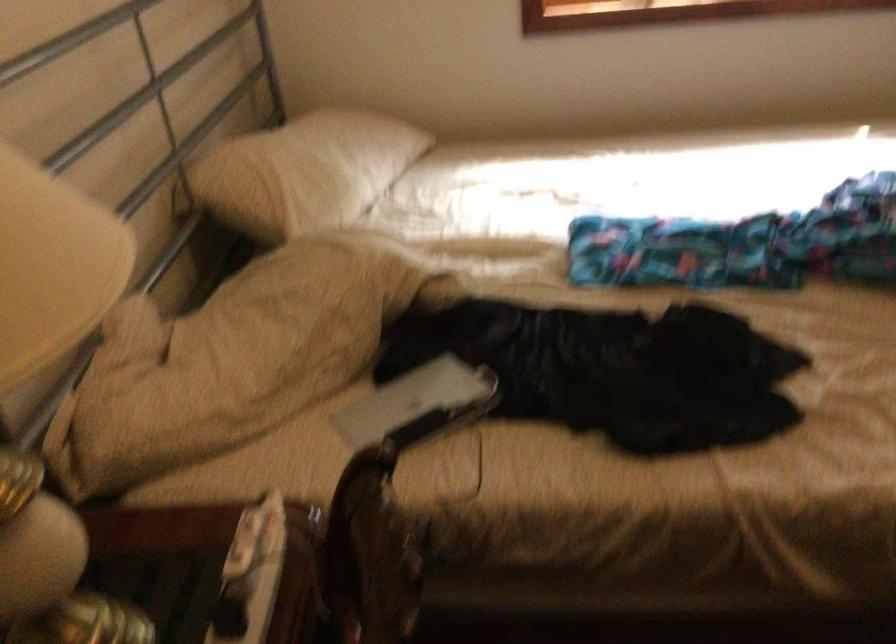
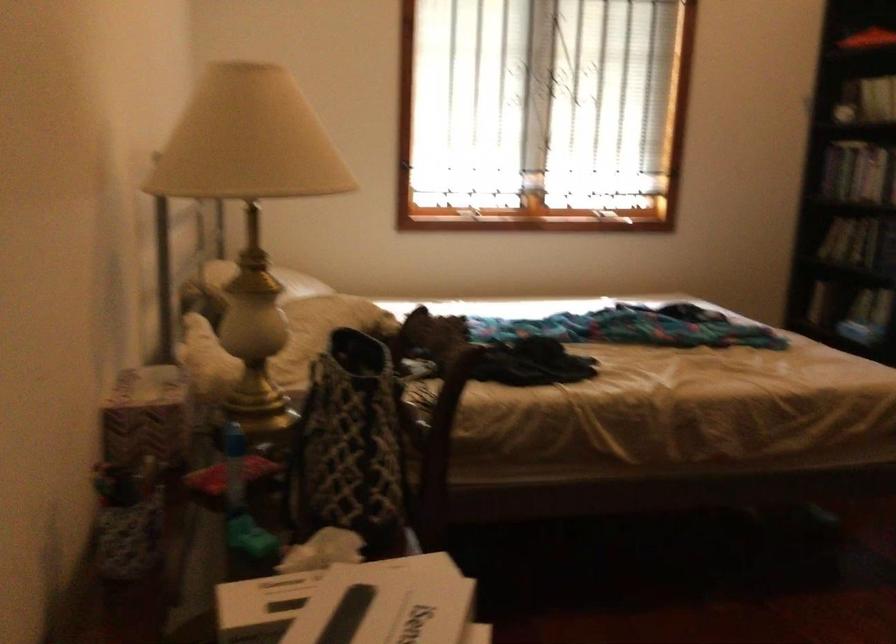
The images are taken continuously from a first-person perspective. In which direction are you moving?

The cameraman moved toward left, backward.